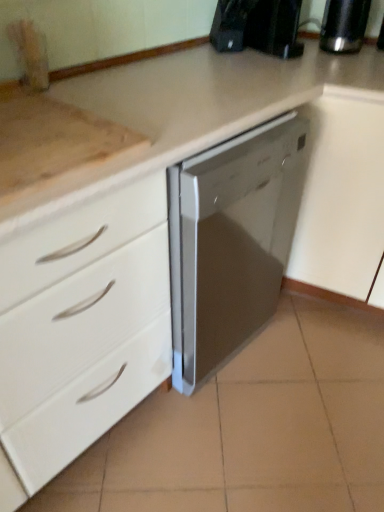
This screenshot has height=512, width=384. Describe the element at coordinates (344, 25) in the screenshot. I see `satin black coffee pot at upper right` at that location.

What is the approximate width of satin black coffee pot at upper right?

satin black coffee pot at upper right is 4.82 inches wide.

What are the coordinates of `satin black coffee pot at upper right` in the screenshot? It's located at (344, 25).

Measure the distance between point (x=330, y=35) and camera.

1.49 meters.

The image size is (384, 512). Find the location of `satin black coffee pot at upper right`. satin black coffee pot at upper right is located at coordinates (344, 25).